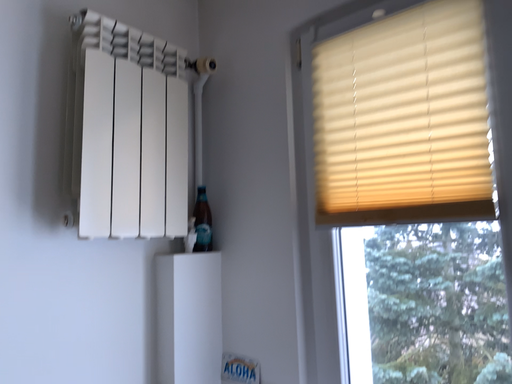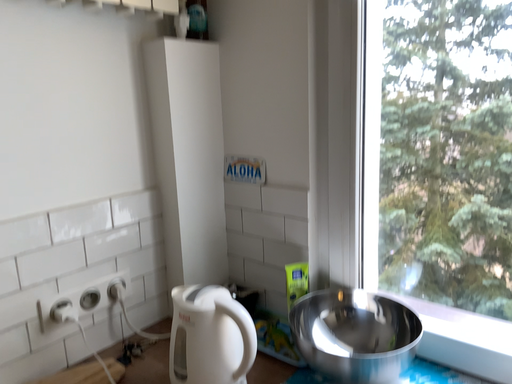
Question: Which way did the camera rotate in the video?

Choices:
 (A) rotated downward
 (B) rotated upward

Answer: (A)